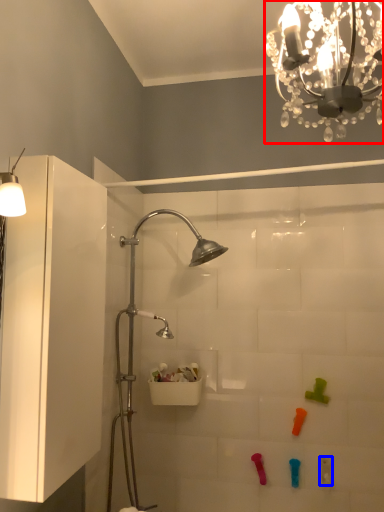
Question: Which of the following is the closest to the observer, light fixture (highlighted by a red box) or toy (highlighted by a blue box)?

Choices:
 (A) light fixture
 (B) toy

Answer: (A)